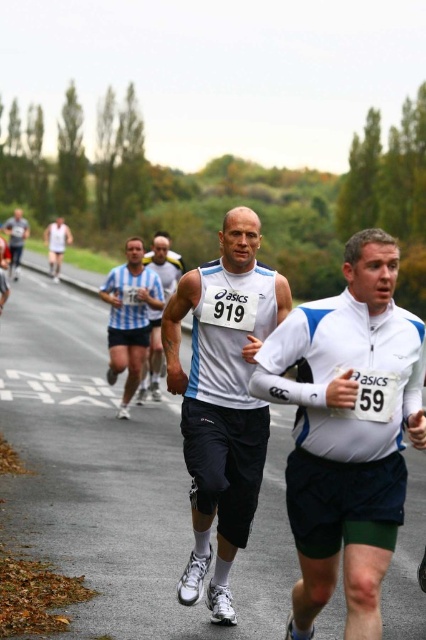
You are a photographer positioned at the center of the image. You want to capture a photo of the white matte running shirt at center. Based on its position, which direction should you aim your camera?

The white matte running shirt at center is located at point (345,433), so you should aim your camera towards the lower right direction to capture it.

From the picture: You are a photographer standing at the starting line of the race, and you want to capture a close shot of the white matte running shirt at center. Since you are currently 4 meters away, can you move closer to get a better shot?

The distance between you and the white matte running shirt at center is 3.99 meters, so you are already within the 4 meter range. Therefore, you can move closer to get a better shot.

You are a photographer positioned at the starting line of the race. You want to capture a photo of both the white matte running shirt at center and the white matte tank top at center. Which runner should you focus on first to ensure both are in sharp focus?

You should focus on the white matte running shirt at center first because it is closer to the viewer than the white matte tank top at center, so adjusting focus from near to far will help ensure both are in sharp focus.